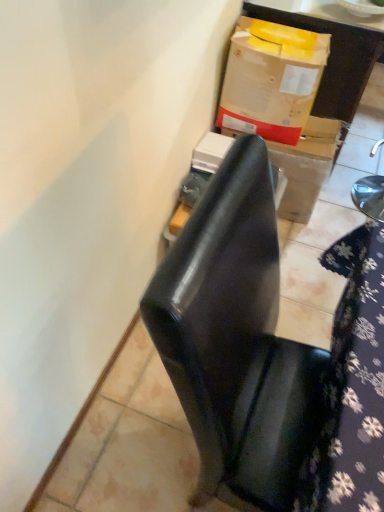
What is the approximate width of cardboard box at upper right?

cardboard box at upper right is 22.06 inches in width.

In the scene shown: In order to face cardboard box at upper right, should I rotate leftwards or rightwards?

Turn right approximately 7.671 degrees to face it.

The width and height of the screenshot is (384, 512). What do you see at coordinates (236, 342) in the screenshot?
I see `glossy black chair at center` at bounding box center [236, 342].

The width and height of the screenshot is (384, 512). Find the location of `cardboard box at upper right`. cardboard box at upper right is located at coordinates (305, 166).

From a real-world perspective, which object rests below the other?

floral fabric at lower right.

Considering the sizes of objects cardboard box at upper right and floral fabric at lower right in the image provided, who is wider, cardboard box at upper right or floral fabric at lower right?

With larger width is floral fabric at lower right.

Between floral fabric at lower right and cardboard box at upper right, which one has smaller size?

cardboard box at upper right is smaller.

Visually, is floral fabric at lower right positioned to the left or to the right of cardboard box at upper right?

Clearly, floral fabric at lower right is on the right of cardboard box at upper right in the image.

Measure the distance between floral fabric at lower right and cardboard box at upper right.

floral fabric at lower right and cardboard box at upper right are 91.57 centimeters apart.

Identify the location of tablecloth on the right of the cardboard box at upper right. Image resolution: width=384 pixels, height=512 pixels. (351, 386).

What's the angular difference between cardboard box at upper right and matte cardboard box at upper right's facing directions?

90.8 degrees.

Are cardboard box at upper right and matte cardboard box at upper right making contact?

cardboard box at upper right and matte cardboard box at upper right are not in contact.

Which of these two, cardboard box at upper right or matte cardboard box at upper right, is thinner?

With smaller width is cardboard box at upper right.

Which is behind, cardboard box at upper right or matte cardboard box at upper right?

cardboard box at upper right is behind.

Can you confirm if cardboard box at upper right is taller than cardboard box at upper right?

Yes.

Could you tell me if cardboard box at upper right is turned towards cardboard box at upper right?

No.

Considering the sizes of cardboard box at upper right and cardboard box at upper right in the image, is cardboard box at upper right wider or thinner than cardboard box at upper right?

Clearly, cardboard box at upper right has less width compared to cardboard box at upper right.

Is cardboard box at upper right bigger or smaller than cardboard box at upper right?

Clearly, cardboard box at upper right is smaller in size than cardboard box at upper right.

Which is in front, matte cardboard box at upper right or glossy black chair at center?

glossy black chair at center is more forward.

Which is closer to the camera, (250, 10) or (281, 367)?

Positioned in front is point (281, 367).

This screenshot has height=512, width=384. Find the location of `chair beneath the matte cardboard box at upper right (from a real-world perspective)`. chair beneath the matte cardboard box at upper right (from a real-world perspective) is located at coordinates (236, 342).

Looking at this image, from a real-world perspective, is matte cardboard box at upper right physically located above or below glossy black chair at center?

matte cardboard box at upper right is situated higher than glossy black chair at center in the real world.

Does cardboard box at upper right turn towards matte cardboard box at upper right?

No.

Would you say cardboard box at upper right contains matte cardboard box at upper right?

No, cardboard box at upper right does not contain matte cardboard box at upper right.

Which object is wider, cardboard box at upper right or matte cardboard box at upper right?

matte cardboard box at upper right is wider.

Is cardboard box at upper right beside matte cardboard box at upper right?

There is a gap between cardboard box at upper right and matte cardboard box at upper right.

Is glossy black chair at center oriented away from cardboard box at upper right?

glossy black chair at center does not have its back to cardboard box at upper right.

In terms of width, does glossy black chair at center look wider or thinner when compared to cardboard box at upper right?

Considering their sizes, glossy black chair at center looks broader than cardboard box at upper right.

Measure the distance from glossy black chair at center to cardboard box at upper right.

glossy black chair at center is 1.14 meters away from cardboard box at upper right.

Where is `cardboard box above the glossy black chair at center (from the image's perspective)`? The height and width of the screenshot is (512, 384). cardboard box above the glossy black chair at center (from the image's perspective) is located at coordinates (305, 166).

In order to click on tablecloth on the right side of cardboard box at upper right in this screenshot , I will do (351, 386).

I want to click on box located above the floral fabric at lower right (from a real-world perspective), so click(x=271, y=80).

When comparing their distances from cardboard box at upper right, does floral fabric at lower right or glossy black chair at center seem further?

glossy black chair at center.

When comparing their distances from cardboard box at upper right, does glossy black chair at center or cardboard box at upper right seem closer?

cardboard box at upper right is positioned closer to the anchor cardboard box at upper right.

From the image, which object appears to be nearer to floral fabric at lower right, matte cardboard box at upper right or glossy black chair at center?

Among the two, glossy black chair at center is located nearer to floral fabric at lower right.

Looking at the image, which one is located further to cardboard box at upper right, cardboard box at upper right or matte cardboard box at upper right?

Based on the image, matte cardboard box at upper right appears to be further to cardboard box at upper right.

From the image, which object appears to be farther from matte cardboard box at upper right, cardboard box at upper right or floral fabric at lower right?

floral fabric at lower right is positioned further to the anchor matte cardboard box at upper right.

Considering their positions, is cardboard box at upper right positioned closer to floral fabric at lower right than cardboard box at upper right?

Among the two, cardboard box at upper right is located nearer to floral fabric at lower right.

When comparing their distances from cardboard box at upper right, does matte cardboard box at upper right or glossy black chair at center seem closer?

matte cardboard box at upper right is positioned closer to the anchor cardboard box at upper right.

When comparing their distances from cardboard box at upper right, does matte cardboard box at upper right or floral fabric at lower right seem further?

Among the two, floral fabric at lower right is located further to cardboard box at upper right.

The height and width of the screenshot is (512, 384). Identify the location of box between glossy black chair at center and cardboard box at upper right in the front-back direction. (271, 80).

In order to click on tablecloth between matte cardboard box at upper right and glossy black chair at center in the up-down direction in this screenshot , I will do `click(351, 386)`.

Image resolution: width=384 pixels, height=512 pixels. I want to click on cardboard box between matte cardboard box at upper right and glossy black chair at center in the up-down direction, so click(305, 166).

This screenshot has height=512, width=384. I want to click on box that lies between matte cardboard box at upper right and glossy black chair at center from top to bottom, so [x=271, y=80].